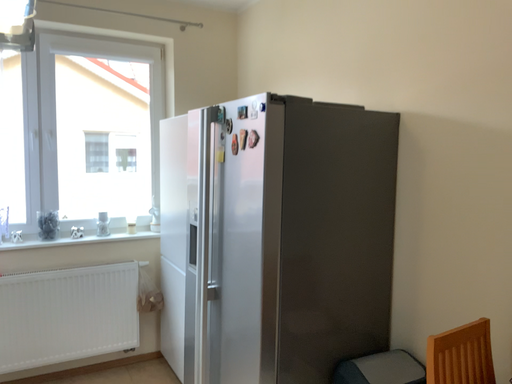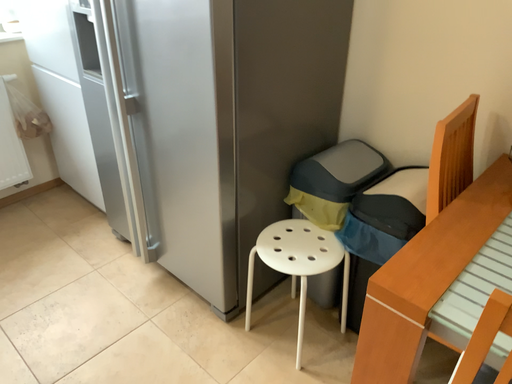
Question: How did the camera likely rotate when shooting the video?

Choices:
 (A) rotated upward
 (B) rotated downward

Answer: (B)